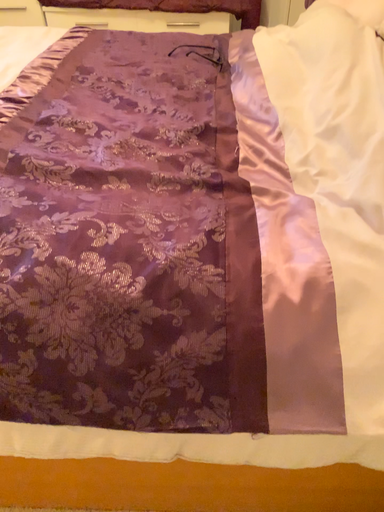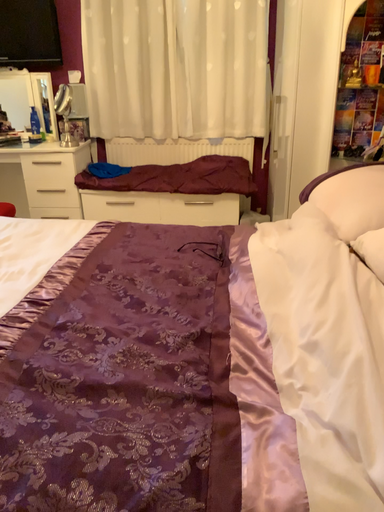
Question: How did the camera likely rotate when shooting the video?

Choices:
 (A) rotated upward
 (B) rotated downward

Answer: (A)